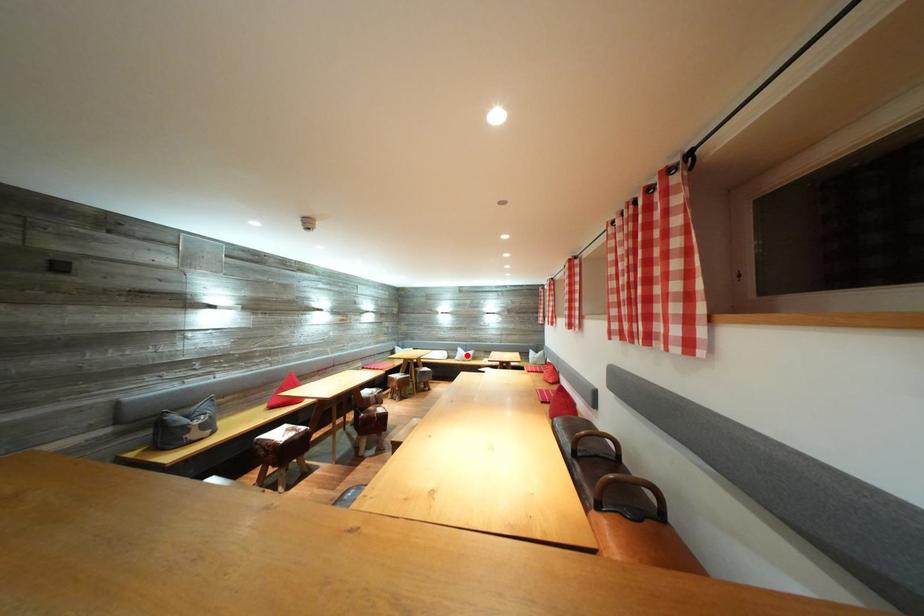
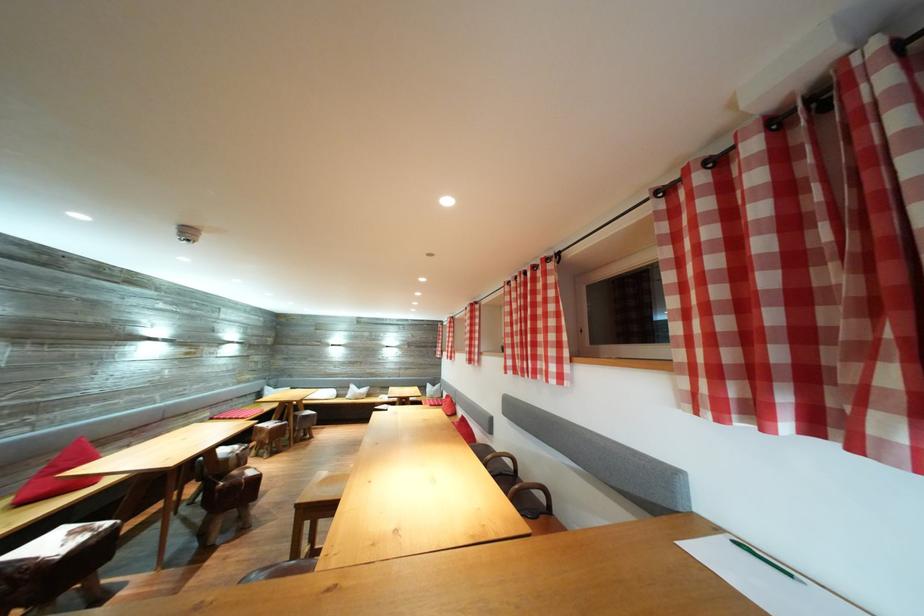
Question: I am providing you with two images of the same scene from different viewpoints. Given a red point in image1, look at the same physical point in image2. Is it:

Choices:
 (A) Closer to the viewpoint
 (B) Farther from the viewpoint

Answer: (B)